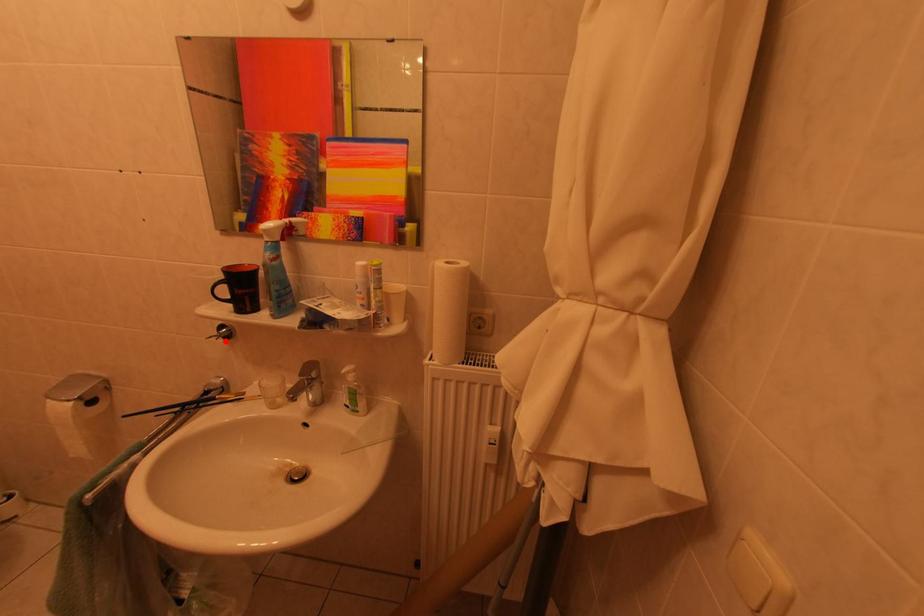
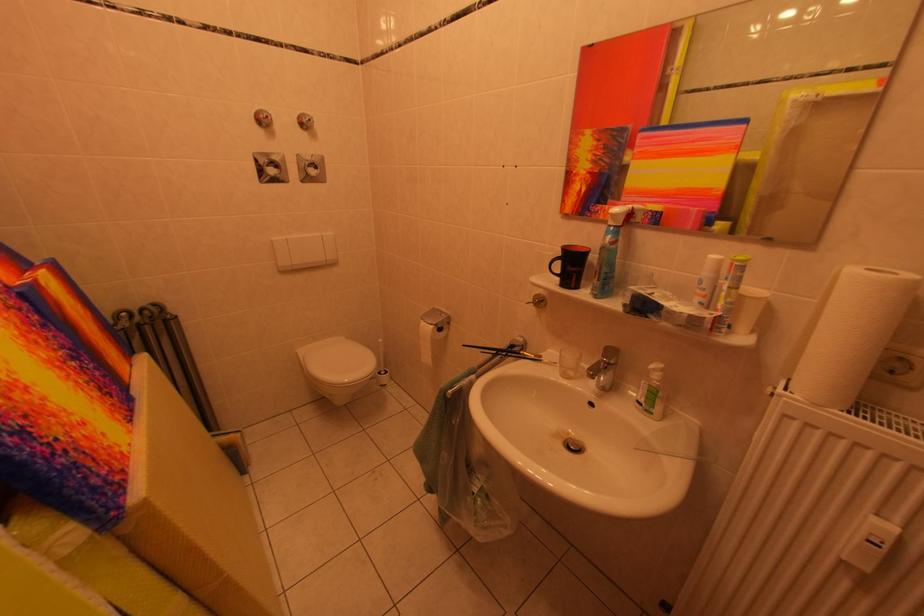
Find the pixel in the second image that matches the highlighted location in the first image.

(541, 308)